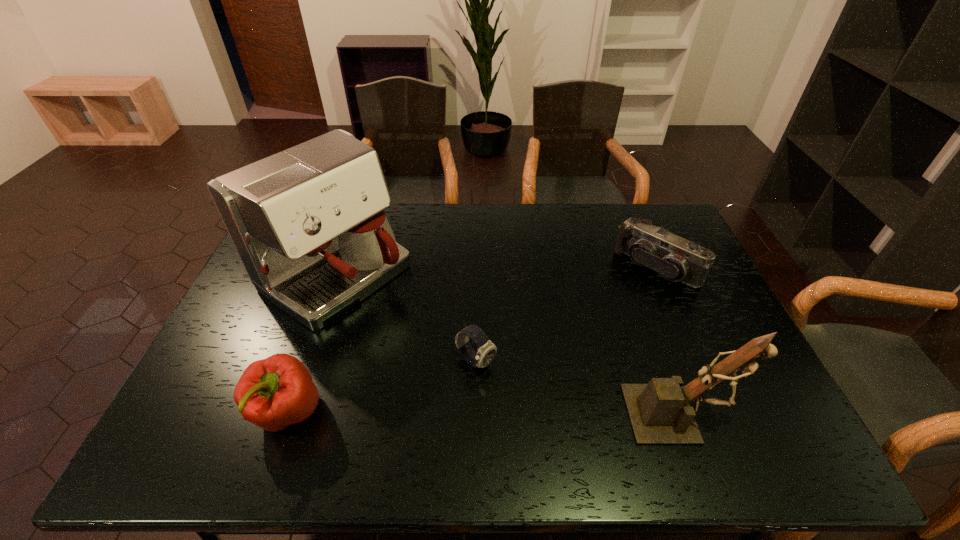
This screenshot has width=960, height=540. What are the coordinates of `object positioned at the left edge` in the screenshot? It's located at [308, 224].

Identify the location of figurine that is at the right edge. The width and height of the screenshot is (960, 540). (659, 412).

I want to click on camcorder that is at the right edge, so click(675, 258).

This screenshot has height=540, width=960. Identify the location of object that is at the far left corner. (308, 224).

Identify the location of object that is at the near right corner. (659, 412).

Locate an element on the screen. The image size is (960, 540). free region at the far edge is located at coordinates (473, 240).

The width and height of the screenshot is (960, 540). Find the location of `blank area at the near edge`. blank area at the near edge is located at coordinates (401, 411).

In the image, there is a desktop. Where is `vacant region at the near left corner`? vacant region at the near left corner is located at coordinates (195, 417).

The height and width of the screenshot is (540, 960). In the image, there is a desktop. In order to click on vacant space at the far right corner in this screenshot , I will do `click(651, 216)`.

Image resolution: width=960 pixels, height=540 pixels. I want to click on vacant space in between the figurine and the bell pepper, so click(484, 413).